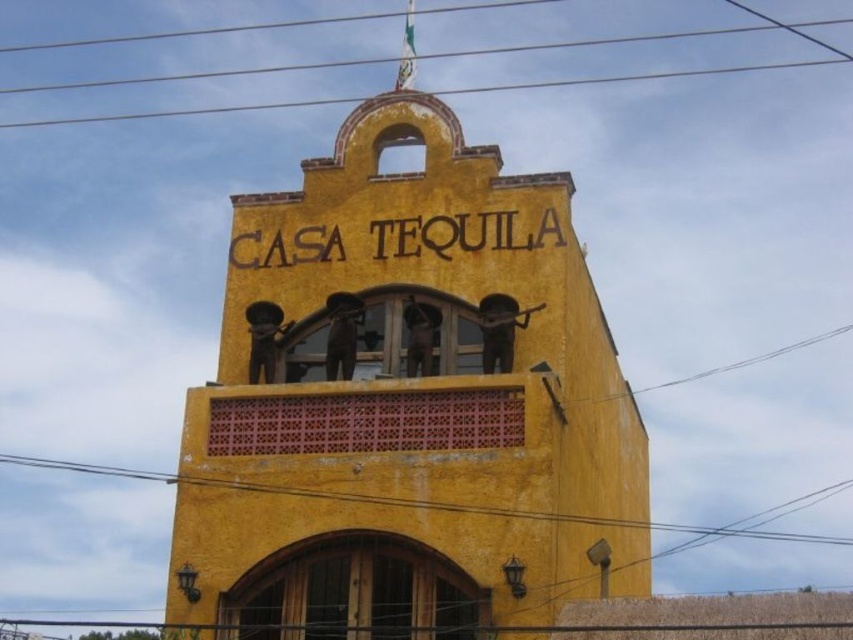
The width and height of the screenshot is (853, 640). Find the location of `yellow stucco building at center`. yellow stucco building at center is located at coordinates (408, 401).

Does point (552, 476) lie in front of point (837, 538)?

That is True.

Measure the distance between yellow stucco building at center and camera.

yellow stucco building at center is 50.07 meters from camera.

Locate an element on the screen. yellow stucco building at center is located at coordinates (408, 401).

Is yellow stucco building at center to the left of metallic wire at upper center from the viewer's perspective?

Incorrect, yellow stucco building at center is not on the left side of metallic wire at upper center.

Which is above, yellow stucco building at center or metallic wire at upper center?

metallic wire at upper center

Is point (372, 244) positioned in front of point (86, 122)?

Yes, it is in front of point (86, 122).

The width and height of the screenshot is (853, 640). What are the coordinates of `yellow stucco building at center` in the screenshot? It's located at (408, 401).

Does metallic wire at upper center have a smaller size compared to metallic wire at lower center?

Yes.

Who is positioned more to the right, metallic wire at upper center or metallic wire at lower center?

metallic wire at upper center

Identify the location of metallic wire at upper center. This screenshot has width=853, height=640. (635, 38).